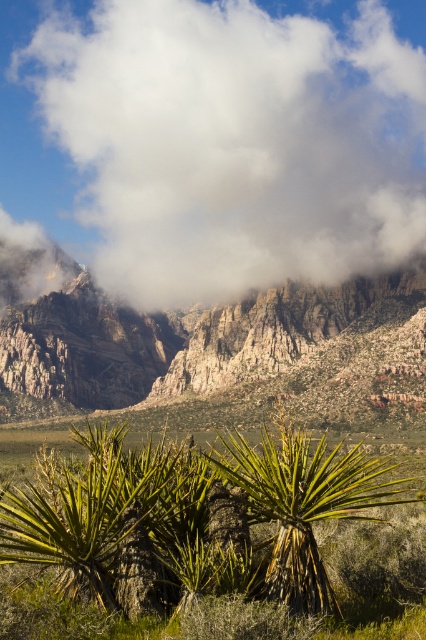
You are standing in the desert landscape and want to take a photo of both the rugged red rock formation at center and the green leafy palm tree at center. Which object should you zoom in on to ensure both fit in the frame?

The rugged red rock formation at center might be wider than the green leafy palm tree at center, so you should zoom in on the wider rugged red rock formation at center to ensure both fit in the frame.

You are planning to set up a campsite in the valley between the rugged red rock formation at center and the green leafy palm tree at center. The tent you have can only be placed within a 100 meter radius of both landmarks. Is this possible?

The rugged red rock formation at center and green leafy palm tree at center are 175.44 meters apart, which exceeds the 100 meter radius requirement. Therefore, it is not possible to set up the tent within 100 meters of both landmarks simultaneously.

Based on the photo, you are an astronomer analyzing the night sky in the image. You notice the white fluffy cloud at upper center. What is its exact location in the image?

The white fluffy cloud at upper center is located at point (x=233, y=141).